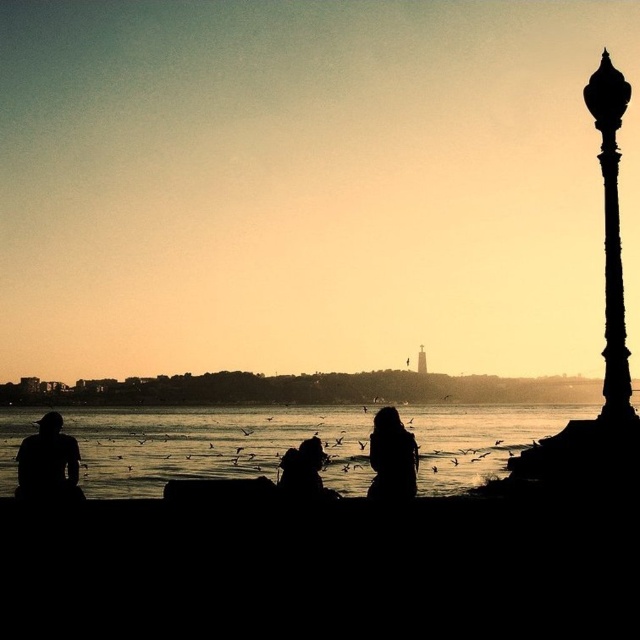
Consider the image. Does matte black jacket at lower left have a lesser width compared to silhouette hoodie at center?

No, matte black jacket at lower left is not thinner than silhouette hoodie at center.

Can you confirm if matte black jacket at lower left is positioned to the right of silhouette hoodie at center?

No, matte black jacket at lower left is not to the right of silhouette hoodie at center.

Is point (67, 476) more distant than point (300, 468)?

Yes, point (67, 476) is behind point (300, 468).

Where is `matte black jacket at lower left`? matte black jacket at lower left is located at coordinates (49, 461).

Between black polished metal lamp post at right and matte black jacket at lower left, which one is positioned higher?

black polished metal lamp post at right is above.

Who is taller, black polished metal lamp post at right or matte black jacket at lower left?

With more height is black polished metal lamp post at right.

Find the location of a particular element. Image resolution: width=640 pixels, height=640 pixels. black polished metal lamp post at right is located at coordinates (611, 236).

In order to click on black polished metal lamp post at right in this screenshot , I will do `click(611, 236)`.

Who is positioned more to the right, matte black jacket at lower left or black matte coat at center?

black matte coat at center is more to the right.

Locate an element on the screen. matte black jacket at lower left is located at coordinates (49, 461).

At what (x,y) coordinates should I click in order to perform the action: click on matte black jacket at lower left. Please return your answer as a coordinate pair (x, y). This screenshot has width=640, height=640. Looking at the image, I should click on (49, 461).